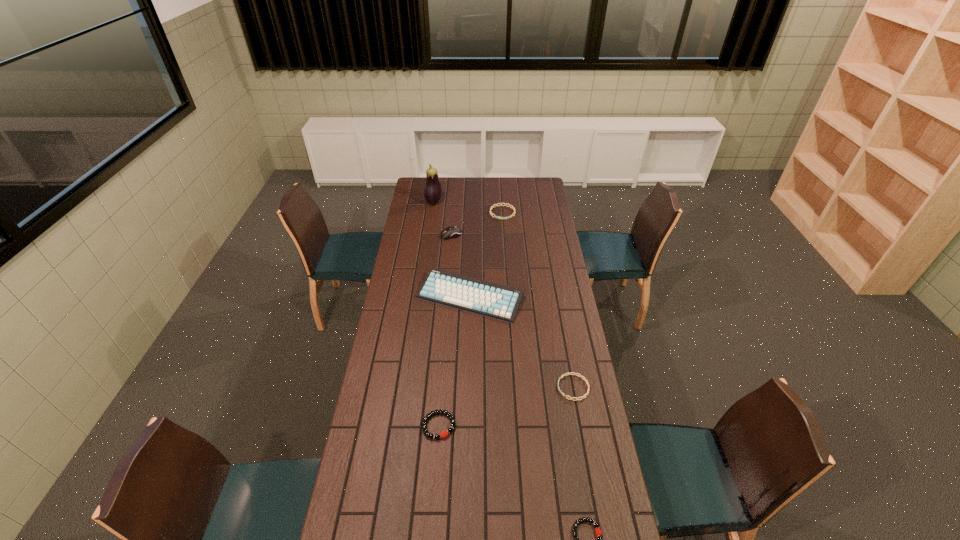
This screenshot has width=960, height=540. What are the coordinates of `the third nearest object` in the screenshot? It's located at (563, 375).

Where is `vacant region located 0.320m on the right of the eggplant`? vacant region located 0.320m on the right of the eggplant is located at coordinates (496, 202).

Image resolution: width=960 pixels, height=540 pixels. Find the location of `free space located 0.140m on the back of the black computer mouse`. free space located 0.140m on the back of the black computer mouse is located at coordinates (453, 215).

Locate an element on the screen. free space located on the right of the gray computer keyboard is located at coordinates (537, 297).

You are a GUI agent. You are given a task and a screenshot of the screen. Output one action in this format:
    pyautogui.click(x=<x>, y=<y>)
    Task: Click on the vacant space situated on the surface of the third bracelet from right to left showing star-shaped elements
    This screenshot has width=960, height=540.
    Given the screenshot: What is the action you would take?
    [x=505, y=246]

In order to click on free space located 0.390m on the right of the left black bracelet in this screenshot , I will do `click(567, 426)`.

The width and height of the screenshot is (960, 540). What are the coordinates of `vacant space located on the surface of the right blue bracelet showing star-shaped elements` in the screenshot? It's located at (460, 387).

Where is `free space located on the surface of the right blue bracelet showing star-shaped elements`? free space located on the surface of the right blue bracelet showing star-shaped elements is located at coordinates (481, 387).

Image resolution: width=960 pixels, height=540 pixels. Identify the location of free location located 0.240m on the surface of the right blue bracelet showing star-shaped elements. (494, 387).

Where is `object present at the far edge`? This screenshot has height=540, width=960. object present at the far edge is located at coordinates (432, 193).